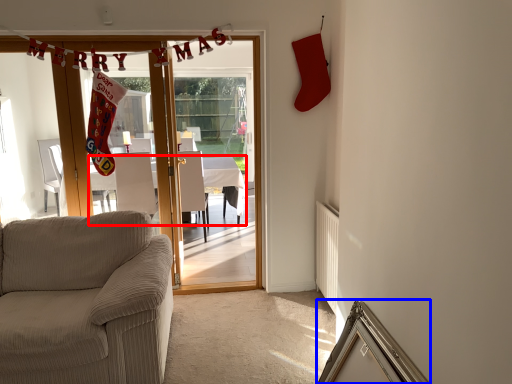
Question: Which point is further to the camera, table (highlighted by a red box) or picture frame (highlighted by a blue box)?

Choices:
 (A) table
 (B) picture frame

Answer: (A)